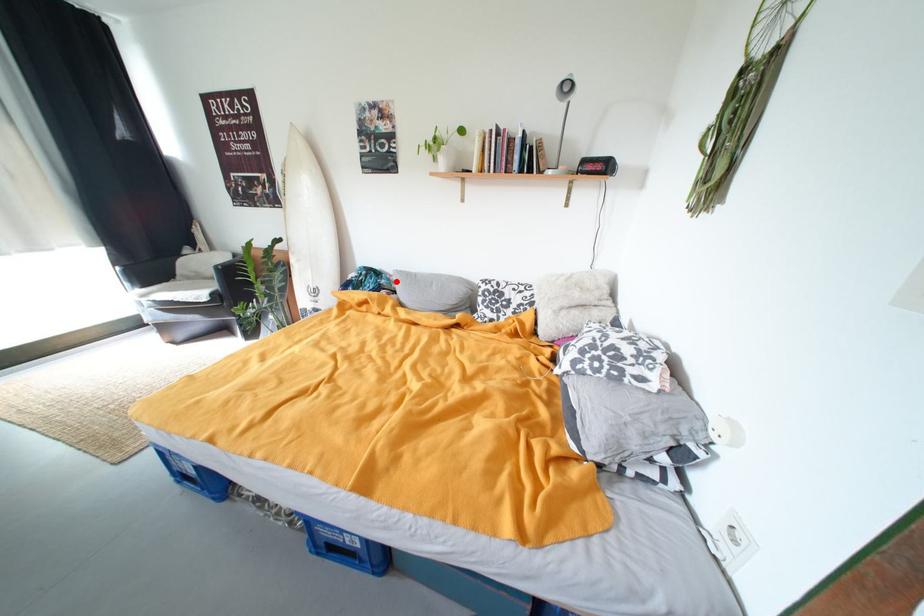
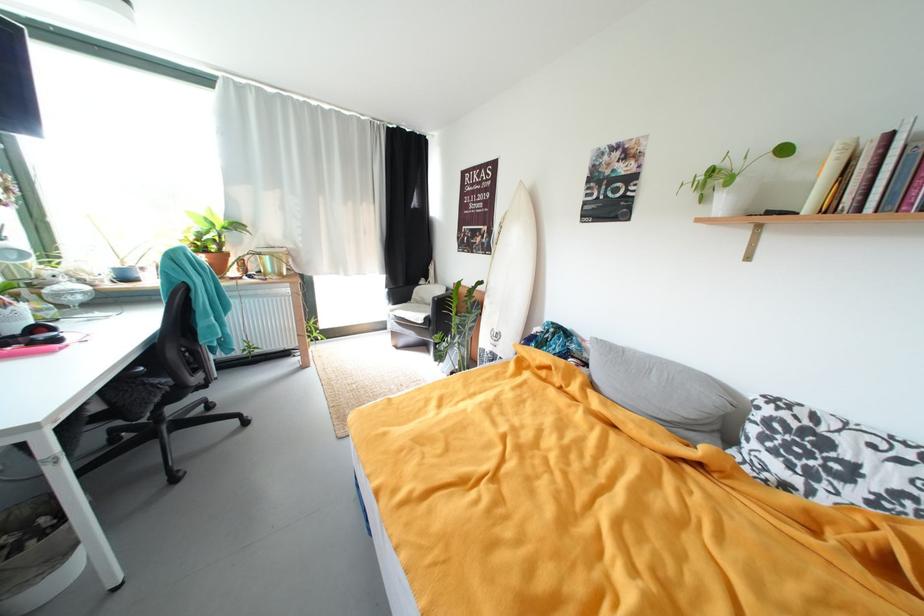
Question: I am providing you with two images of the same scene from different viewpoints. In image1, a red point is highlighted. Considering the same 3D point in image2, which of the following is correct?

Choices:
 (A) It is closer
 (B) It is farther

Answer: (B)